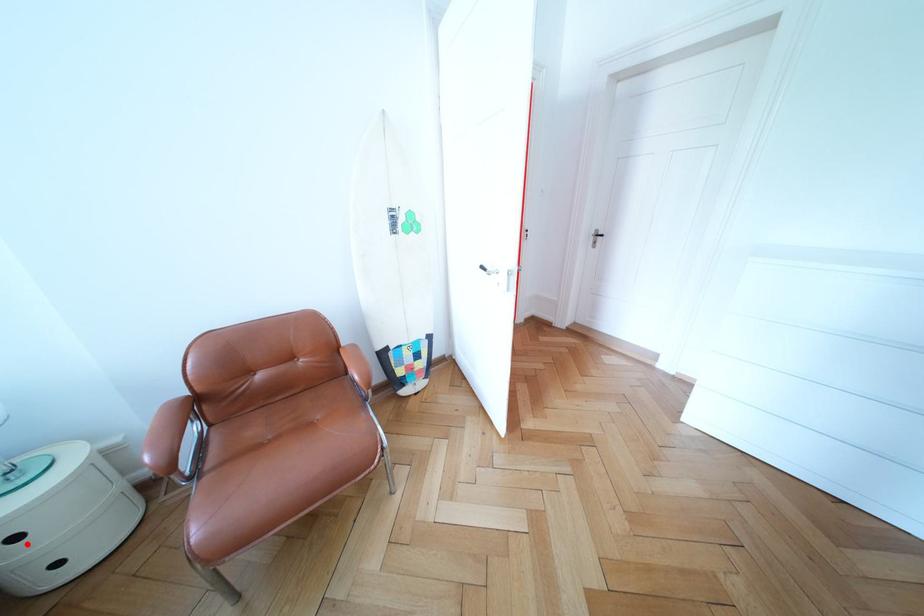
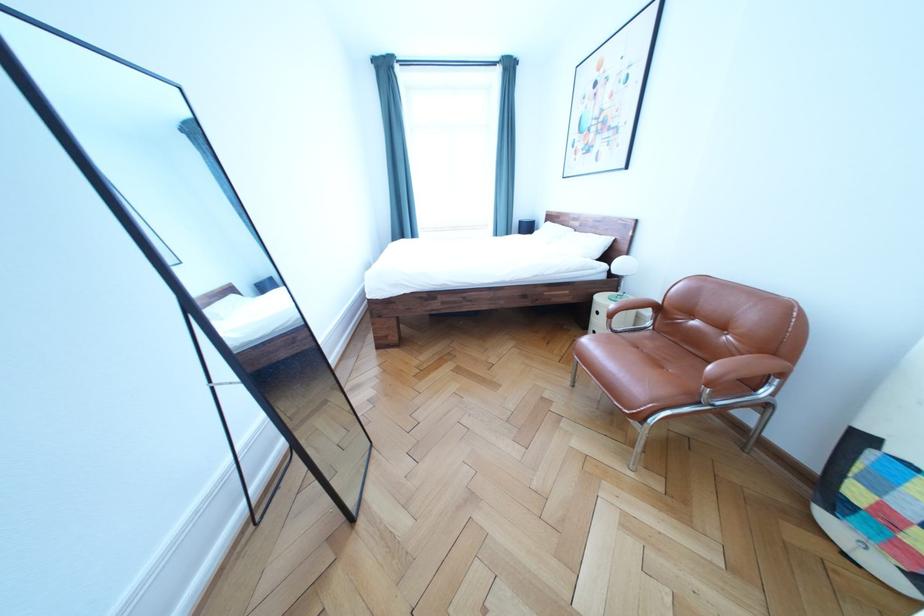
Question: I am providing you with two images of the same scene from different viewpoints. A red point is marked on the first image. Is the red point's position out of view in image 2?

Choices:
 (A) Yes
 (B) No

Answer: (B)